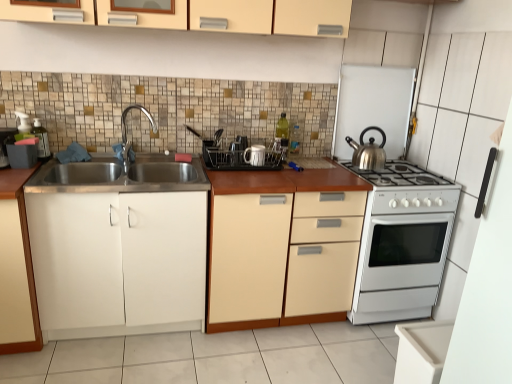
Question: Does translucent plastic soap dispenser at left, which is the 1th appliance from left to right, have a smaller size compared to black plastic dish rack at center, acting as the third appliance starting from the right?

Choices:
 (A) yes
 (B) no

Answer: (A)

Question: Is translucent plastic soap dispenser at left, which is the 1th appliance from left to right, to the left of black plastic dish rack at center, the third appliance in the left-to-right sequence, from the viewer's perspective?

Choices:
 (A) no
 (B) yes

Answer: (B)

Question: Is translucent plastic soap dispenser at left, which is the 1th appliance from left to right, outside black plastic dish rack at center, the third appliance in the left-to-right sequence?

Choices:
 (A) yes
 (B) no

Answer: (A)

Question: Does translucent plastic soap dispenser at left, the 5th appliance viewed from the right, have a lesser height compared to black plastic dish rack at center, acting as the third appliance starting from the right?

Choices:
 (A) yes
 (B) no

Answer: (B)

Question: Considering the relative sizes of translucent plastic soap dispenser at left, the 5th appliance viewed from the right, and black plastic dish rack at center, acting as the third appliance starting from the right, in the image provided, is translucent plastic soap dispenser at left, the 5th appliance viewed from the right, taller than black plastic dish rack at center, acting as the third appliance starting from the right,?

Choices:
 (A) no
 (B) yes

Answer: (B)

Question: Relative to shiny metallic kettle at right, is silver metallic kettle at upper right, which is counted as the 5th appliance, starting from the left, in front or behind?

Choices:
 (A) behind
 (B) front

Answer: (A)

Question: From a real-world perspective, is silver metallic kettle at upper right, which is counted as the 5th appliance, starting from the left, positioned above or below shiny metallic kettle at right?

Choices:
 (A) below
 (B) above

Answer: (B)

Question: From their relative heights in the image, would you say silver metallic kettle at upper right, which is the first appliance from right to left, is taller or shorter than shiny metallic kettle at right?

Choices:
 (A) short
 (B) tall

Answer: (B)

Question: Is silver metallic kettle at upper right, which is counted as the 5th appliance, starting from the left, wider or thinner than shiny metallic kettle at right?

Choices:
 (A) wide
 (B) thin

Answer: (B)

Question: Which is correct: clear plastic utensil rack at center, which ranks as the 2th appliance in left-to-right order, is inside black plastic dish rack at center, acting as the third appliance starting from the right, or outside of it?

Choices:
 (A) outside
 (B) inside

Answer: (B)

Question: From their relative heights in the image, would you say clear plastic utensil rack at center, which ranks as the 2th appliance in left-to-right order, is taller or shorter than black plastic dish rack at center, the third appliance in the left-to-right sequence?

Choices:
 (A) tall
 (B) short

Answer: (A)

Question: Based on their positions, is clear plastic utensil rack at center, which ranks as the 2th appliance in left-to-right order, located to the left or right of black plastic dish rack at center, acting as the third appliance starting from the right?

Choices:
 (A) right
 (B) left

Answer: (B)

Question: From a real-world perspective, is clear plastic utensil rack at center, which ranks as the 2th appliance in left-to-right order, positioned above or below black plastic dish rack at center, acting as the third appliance starting from the right?

Choices:
 (A) below
 (B) above

Answer: (B)

Question: Would you say shiny metallic kettle at right is to the left or to the right of black plastic dish rack at center, the third appliance in the left-to-right sequence, in the picture?

Choices:
 (A) right
 (B) left

Answer: (A)

Question: From their relative heights in the image, would you say shiny metallic kettle at right is taller or shorter than black plastic dish rack at center, the third appliance in the left-to-right sequence?

Choices:
 (A) short
 (B) tall

Answer: (B)